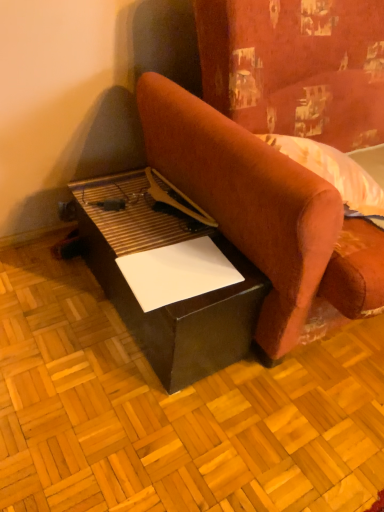
Question: Is velvet-like red couch at center inside the boundaries of white paper at lower center, or outside?

Choices:
 (A) inside
 (B) outside

Answer: (B)

Question: From their relative heights in the image, would you say velvet-like red couch at center is taller or shorter than white paper at lower center?

Choices:
 (A) short
 (B) tall

Answer: (B)

Question: Which is farther from the velvet-like red couch at center?

Choices:
 (A) black leather table at lower left
 (B) white paper at lower center

Answer: (B)

Question: Which is nearer to the white paper at lower center?

Choices:
 (A) velvet-like red couch at center
 (B) black leather table at lower left

Answer: (B)